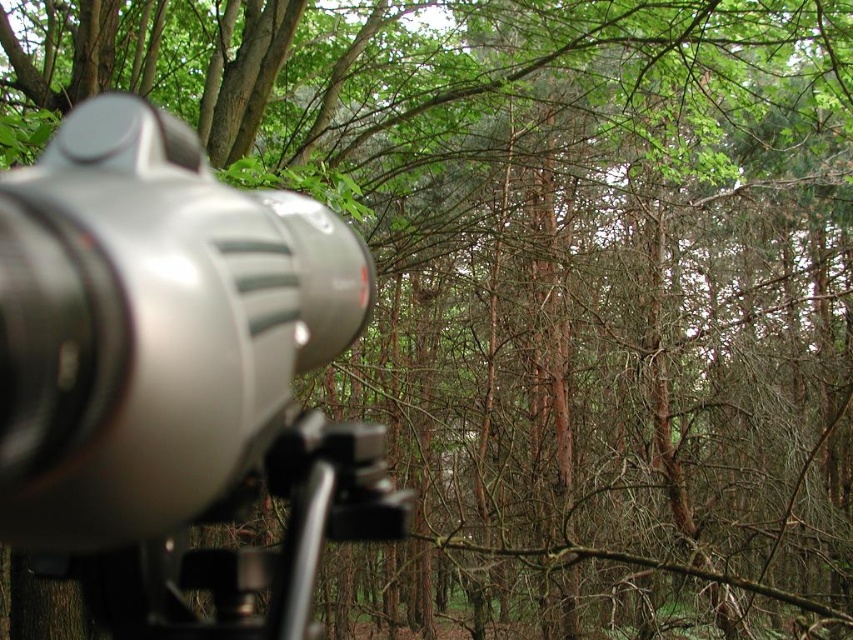
Does point (227, 438) come behind point (231, 584)?

No, it is not.

Can you confirm if satin silver camera at left is smaller than satin black tripod at lower left?

Incorrect, satin silver camera at left is not smaller in size than satin black tripod at lower left.

Which is behind, point (201, 301) or point (305, 604)?

Point (305, 604)

Locate an element on the screen. This screenshot has width=853, height=640. satin silver camera at left is located at coordinates (151, 326).